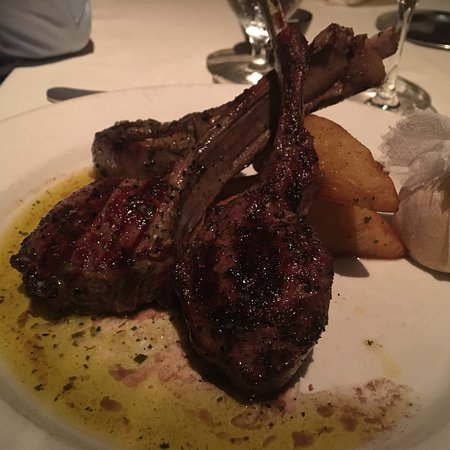
This screenshot has height=450, width=450. I want to click on tip of handle for silverware, so click(x=58, y=86).